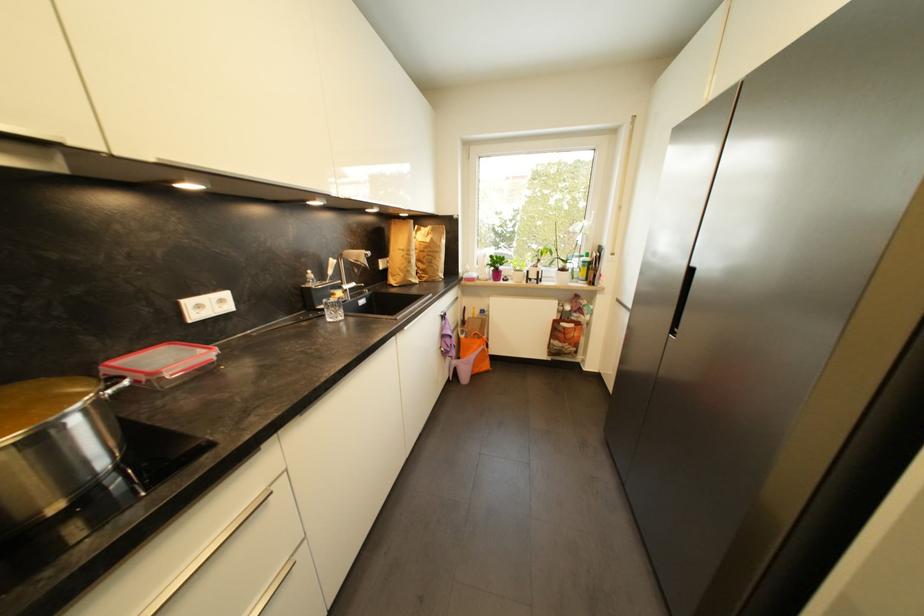
At what (x,y) coordinates should I click in order to perform the action: click on white window handle. Please return your answer as a coordinate pair (x, y). The image size is (924, 616). Looking at the image, I should click on (589, 222).